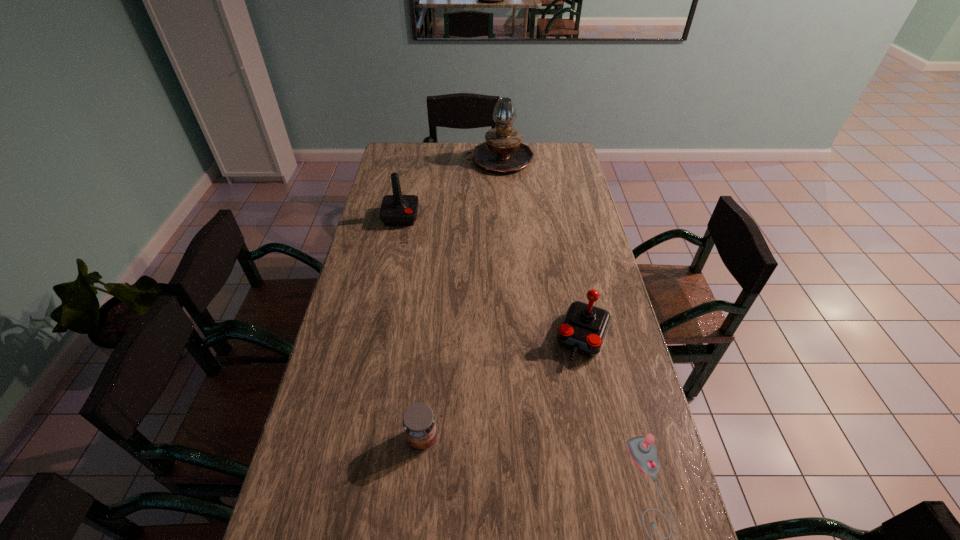
Locate which joystick ranks in proximity to the oil lamp. Please provide its 2D coordinates. Your answer should be formatted as a tuple, i.e. [(x, y)], where the tuple contains the x and y coordinates of a point satisfying the conditions above.

[(396, 210)]

I want to click on free space that satisfies the following two spatial constraints: 1. on the front side of the third nearest object; 2. on the right side of the oil lamp, so click(511, 338).

Image resolution: width=960 pixels, height=540 pixels. Identify the location of vacant space that satisfies the following two spatial constraints: 1. on the front side of the second nearest joystick; 2. on the left side of the oil lamp. (511, 338).